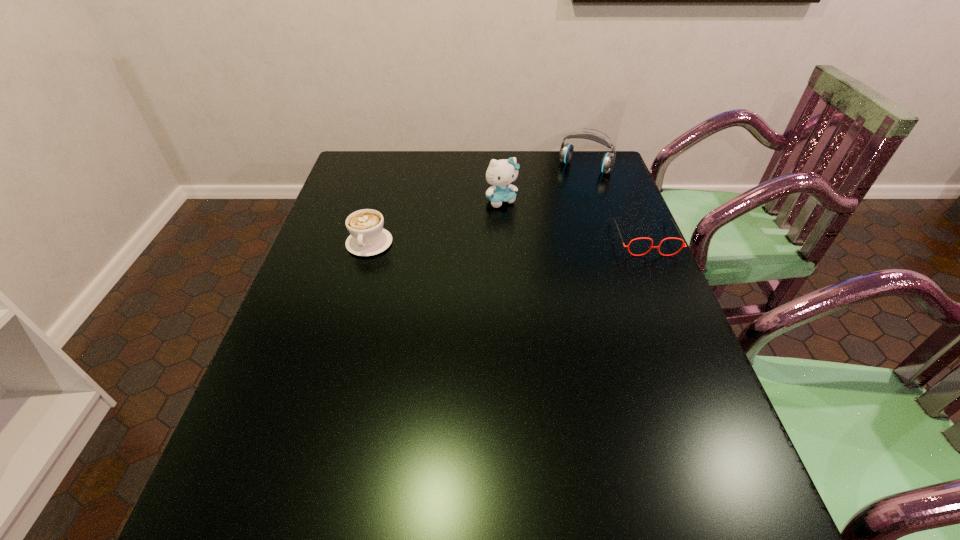
The width and height of the screenshot is (960, 540). I want to click on free point located 0.170m on the face of the kitten, so pyautogui.click(x=536, y=242).

Locate an element on the screen. The height and width of the screenshot is (540, 960). free spot located on the ear cups of the farthest object is located at coordinates (535, 235).

At what (x,y) coordinates should I click in order to perform the action: click on free space located on the ear cups of the farthest object. Please return your answer as a coordinate pair (x, y). Looking at the image, I should click on (542, 224).

You are a GUI agent. You are given a task and a screenshot of the screen. Output one action in this format:
    pyautogui.click(x=<x>, y=<y>)
    Task: Click on the free region located on the ear cups of the farthest object
    
    Given the screenshot: What is the action you would take?
    pyautogui.click(x=532, y=239)

You are a GUI agent. You are given a task and a screenshot of the screen. Output one action in this format:
    pyautogui.click(x=<x>, y=<y>)
    Task: Click on the object that is at the far edge
    Image resolution: width=960 pixels, height=540 pixels.
    Given the screenshot: What is the action you would take?
    pyautogui.click(x=566, y=151)

Locate an element on the screen. The width and height of the screenshot is (960, 540). object located at the left edge is located at coordinates (368, 237).

This screenshot has height=540, width=960. I want to click on spectacles at the right edge, so click(x=658, y=247).

You are a GUI agent. You are given a task and a screenshot of the screen. Output one action in this format:
    pyautogui.click(x=<x>, y=<y>)
    Task: Click on the headset located in the right edge section of the desktop
    The height and width of the screenshot is (540, 960).
    Given the screenshot: What is the action you would take?
    pyautogui.click(x=566, y=151)

This screenshot has width=960, height=540. Identify the location of object present at the far right corner. (566, 151).

You are a GUI agent. You are given a task and a screenshot of the screen. Output one action in this format:
    pyautogui.click(x=<x>, y=<y>)
    Task: Click on the free space at the far edge
    The height and width of the screenshot is (540, 960).
    Given the screenshot: What is the action you would take?
    pyautogui.click(x=522, y=166)